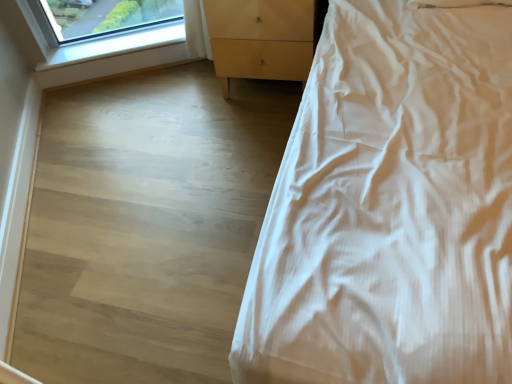
Where is `clear glass window at upper left`? clear glass window at upper left is located at coordinates (96, 40).

What do you see at coordinates (260, 39) in the screenshot? The width and height of the screenshot is (512, 384). I see `light wood/texture chest of drawers at center` at bounding box center [260, 39].

Identify the location of light wood at upper left. This screenshot has height=384, width=512. (113, 65).

Identify the location of clear glass window at upper left. This screenshot has height=384, width=512. (96, 40).

From a real-world perspective, between clear glass window at upper left and light wood at upper left, who is vertically higher?

clear glass window at upper left is physically above.

Would you say clear glass window at upper left is inside or outside light wood at upper left?

clear glass window at upper left cannot be found inside light wood at upper left.

Looking at this image, does clear glass window at upper left appear on the right side of light wood at upper left?

Yes, clear glass window at upper left is to the right of light wood at upper left.

In terms of height, does clear glass window at upper left look taller or shorter compared to light wood at upper left?

Considering their sizes, clear glass window at upper left has less height than light wood at upper left.

Considering the relative positions of light wood at upper left and light wood/texture chest of drawers at center in the image provided, is light wood at upper left to the left of light wood/texture chest of drawers at center from the viewer's perspective?

Indeed, light wood at upper left is positioned on the left side of light wood/texture chest of drawers at center.

Who is smaller, light wood at upper left or light wood/texture chest of drawers at center?

light wood at upper left is smaller.

Which of these two, light wood at upper left or light wood/texture chest of drawers at center, stands taller?

light wood/texture chest of drawers at center.

From a real-world perspective, is light wood at upper left physically located above or below light wood/texture chest of drawers at center?

light wood at upper left is below light wood/texture chest of drawers at center.

Which object is positioned more to the right, clear glass window at upper left or white smooth bed at right?

Positioned to the right is white smooth bed at right.

Considering the sizes of objects clear glass window at upper left and white smooth bed at right in the image provided, who is thinner, clear glass window at upper left or white smooth bed at right?

clear glass window at upper left.

Is point (106, 43) closer or farther from the camera than point (410, 111)?

Point (106, 43) is positioned farther from the camera compared to point (410, 111).

What's the angular difference between white smooth bed at right and light wood/texture chest of drawers at center's facing directions?

They differ by 3.47 degrees in their facing directions.

Who is shorter, white smooth bed at right or light wood/texture chest of drawers at center?

With less height is light wood/texture chest of drawers at center.

From the image's perspective, which is below, white smooth bed at right or light wood/texture chest of drawers at center?

white smooth bed at right appears lower in the image.

Which of these two, white smooth bed at right or light wood/texture chest of drawers at center, is smaller?

light wood/texture chest of drawers at center is smaller.

Is light wood/texture chest of drawers at center facing away from clear glass window at upper left?

No, light wood/texture chest of drawers at center is not facing the opposite direction of clear glass window at upper left.

Considering the sizes of objects light wood/texture chest of drawers at center and clear glass window at upper left in the image provided, who is bigger, light wood/texture chest of drawers at center or clear glass window at upper left?

light wood/texture chest of drawers at center.

What's the angular difference between light wood/texture chest of drawers at center and clear glass window at upper left's facing directions?

There is a 26.4-degree angle between the facing directions of light wood/texture chest of drawers at center and clear glass window at upper left.

From a real-world perspective, is light wood/texture chest of drawers at center above or below clear glass window at upper left?

light wood/texture chest of drawers at center is above clear glass window at upper left.

Which object is wider, light wood at upper left or white smooth bed at right?

With larger width is white smooth bed at right.

Which of these two, light wood at upper left or white smooth bed at right, stands taller?

With more height is white smooth bed at right.

From the picture: Can you confirm if light wood at upper left is bigger than white smooth bed at right?

Incorrect, light wood at upper left is not larger than white smooth bed at right.

Is light wood at upper left oriented away from white smooth bed at right?

No, light wood at upper left is not facing the opposite direction of white smooth bed at right.

In terms of width, does light wood/texture chest of drawers at center look wider or thinner when compared to white smooth bed at right?

Clearly, light wood/texture chest of drawers at center has less width compared to white smooth bed at right.

From a real-world perspective, does light wood/texture chest of drawers at center stand above white smooth bed at right?

No, from a real-world perspective, light wood/texture chest of drawers at center is not over white smooth bed at right

Is light wood/texture chest of drawers at center looking in the opposite direction of white smooth bed at right?

That's not correct — light wood/texture chest of drawers at center is not looking away from white smooth bed at right.

You are a GUI agent. You are given a task and a screenshot of the screen. Output one action in this format:
    pyautogui.click(x=<x>, y=<y>)
    Task: Click on the chest of drawers located behind the white smooth bed at right
    
    Given the screenshot: What is the action you would take?
    pyautogui.click(x=260, y=39)

Find the location of a particular element. window that appears above the light wood at upper left (from a real-world perspective) is located at coordinates (96, 40).

Identify the location of the chest of drawers lying above the light wood at upper left (from the image's perspective). (260, 39).

When comparing their distances from white smooth bed at right, does clear glass window at upper left or light wood at upper left seem closer?

clear glass window at upper left is positioned closer to the anchor white smooth bed at right.

Estimate the real-world distances between objects in this image. Which object is closer to white smooth bed at right, light wood at upper left or clear glass window at upper left?

The object closer to white smooth bed at right is clear glass window at upper left.

Estimate the real-world distances between objects in this image. Which object is further from white smooth bed at right, light wood at upper left or light wood/texture chest of drawers at center?

Based on the image, light wood at upper left appears to be further to white smooth bed at right.

When comparing their distances from light wood at upper left, does white smooth bed at right or clear glass window at upper left seem further?

white smooth bed at right is further to light wood at upper left.

Considering their positions, is white smooth bed at right positioned closer to light wood/texture chest of drawers at center than clear glass window at upper left?

clear glass window at upper left is closer to light wood/texture chest of drawers at center.

From the image, which object appears to be nearer to white smooth bed at right, light wood/texture chest of drawers at center or light wood at upper left?

light wood/texture chest of drawers at center.

Based on their spatial positions, is white smooth bed at right or light wood at upper left further from clear glass window at upper left?

white smooth bed at right lies further to clear glass window at upper left than the other object.

From the picture: Estimate the real-world distances between objects in this image. Which object is closer to light wood at upper left, clear glass window at upper left or white smooth bed at right?

clear glass window at upper left is closer to light wood at upper left.

Identify the location of chest of drawers between white smooth bed at right and light wood at upper left from front to back. (260, 39).

Find the location of a particular element. This screenshot has height=384, width=512. window between white smooth bed at right and light wood at upper left along the z-axis is located at coordinates (96, 40).

Find the location of `the chest of drawers located between white smooth bed at right and clear glass window at upper left in the depth direction`. the chest of drawers located between white smooth bed at right and clear glass window at upper left in the depth direction is located at coordinates (260, 39).

Where is `window located between light wood at upper left and light wood/texture chest of drawers at center in the left-right direction`? This screenshot has width=512, height=384. window located between light wood at upper left and light wood/texture chest of drawers at center in the left-right direction is located at coordinates [x=96, y=40].